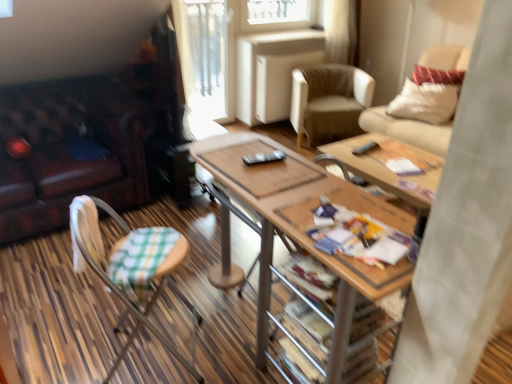
Find the location of a particular element. The image size is (512, 384). free location in front of black plastic remote control at center, the 1th remote control in the bottom-to-top sequence is located at coordinates (270, 178).